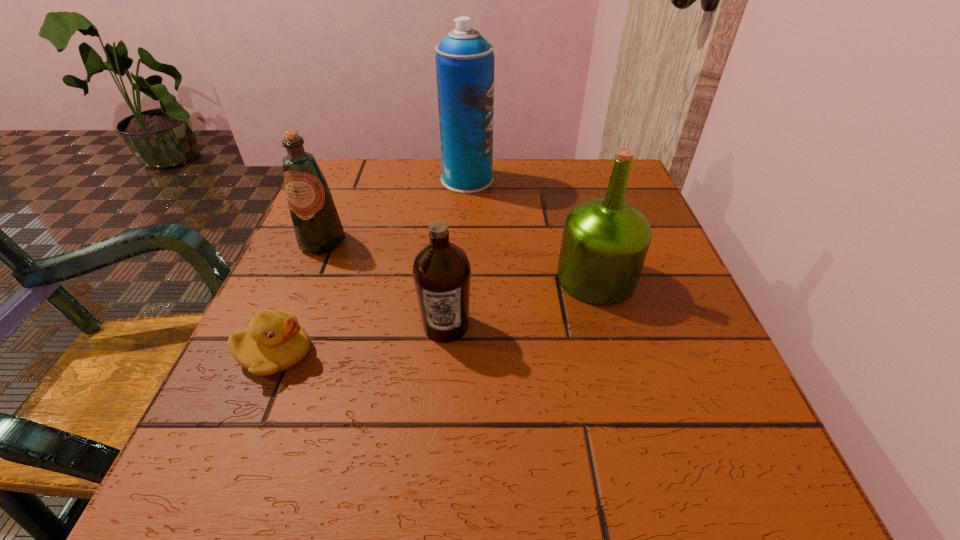
Locate which object ranks in proximity to the leftmost olive oil. Please provide its 2D coordinates. Your answer should be formatted as a tuple, i.e. [(x, y)], where the tuple contains the x and y coordinates of a point satisfying the conditions above.

[(274, 342)]

Where is `olive oil that stands as the third closest to the tallest object`? The image size is (960, 540). olive oil that stands as the third closest to the tallest object is located at coordinates (441, 271).

Select which olive oil appears as the second closest to the leftmost olive oil. Please provide its 2D coordinates. Your answer should be formatted as a tuple, i.e. [(x, y)], where the tuple contains the x and y coordinates of a point satisfying the conditions above.

[(605, 241)]

Where is `free space that satisfies the following two spatial constraints: 1. on the front-facing side of the leftmost olive oil; 2. at the beak of the duckling`? The width and height of the screenshot is (960, 540). free space that satisfies the following two spatial constraints: 1. on the front-facing side of the leftmost olive oil; 2. at the beak of the duckling is located at coordinates (276, 354).

The height and width of the screenshot is (540, 960). Find the location of `blank space that satisfies the following two spatial constraints: 1. on the front side of the rightmost object; 2. at the beak of the duckling`. blank space that satisfies the following two spatial constraints: 1. on the front side of the rightmost object; 2. at the beak of the duckling is located at coordinates (617, 354).

Identify the location of vacant position in the image that satisfies the following two spatial constraints: 1. on the front-facing side of the rightmost object; 2. on the right side of the leftmost olive oil. The image size is (960, 540). (307, 278).

Find the location of `free space that satisfies the following two spatial constraints: 1. on the front-facing side of the leftmost olive oil; 2. at the beak of the duckling`. free space that satisfies the following two spatial constraints: 1. on the front-facing side of the leftmost olive oil; 2. at the beak of the duckling is located at coordinates (276, 354).

Where is `free space that satisfies the following two spatial constraints: 1. on the front-facing side of the leftmost olive oil; 2. at the beak of the shortest object`? Image resolution: width=960 pixels, height=540 pixels. free space that satisfies the following two spatial constraints: 1. on the front-facing side of the leftmost olive oil; 2. at the beak of the shortest object is located at coordinates (276, 354).